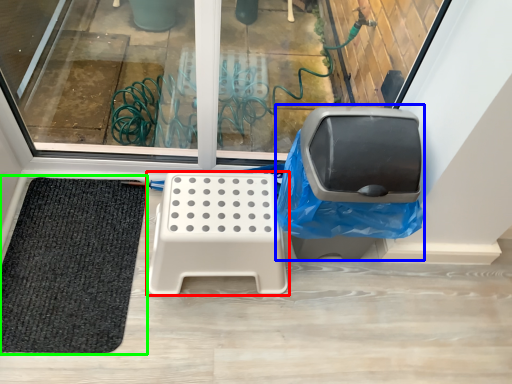
Question: Which is nearer to the furniture (highlighted by a red box)? swivel chair (highlighted by a blue box) or mat (highlighted by a green box).

Choices:
 (A) swivel chair
 (B) mat

Answer: (A)